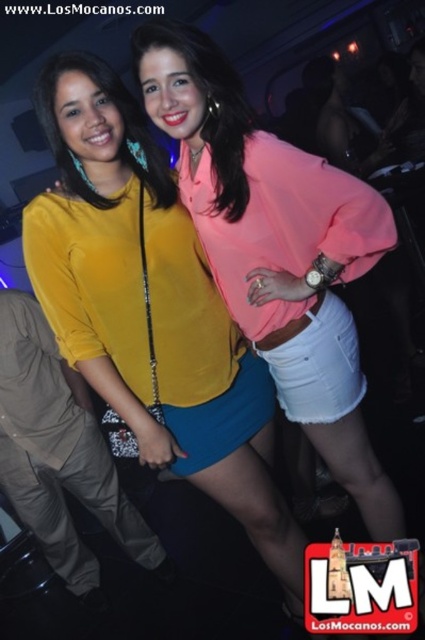
Does pink satin blouse at center appear on the right side of yellow fabric shorts at center?

Correct, you'll find pink satin blouse at center to the right of yellow fabric shorts at center.

Can you confirm if pink satin blouse at center is bigger than yellow fabric shorts at center?

Yes.

Is point (360, 502) positioned before point (19, 296)?

Yes, point (360, 502) is in front of point (19, 296).

What are the coordinates of `pink satin blouse at center` in the screenshot? It's located at (277, 248).

Who is positioned more to the left, matte yellow blouse at center or pink satin blouse at center?

Positioned to the left is matte yellow blouse at center.

Is point (96, 317) behind point (312, 164)?

Yes, point (96, 317) is behind point (312, 164).

Between point (183, 348) and point (316, 428), which one is positioned behind?

Point (316, 428)

Image resolution: width=425 pixels, height=640 pixels. Identify the location of matte yellow blouse at center. (150, 308).

Does matte yellow blouse at center appear on the left side of yellow fabric shorts at center?

Incorrect, matte yellow blouse at center is not on the left side of yellow fabric shorts at center.

Who is lower down, matte yellow blouse at center or yellow fabric shorts at center?

Positioned lower is yellow fabric shorts at center.

Locate an element on the screen. This screenshot has width=425, height=640. matte yellow blouse at center is located at coordinates (150, 308).